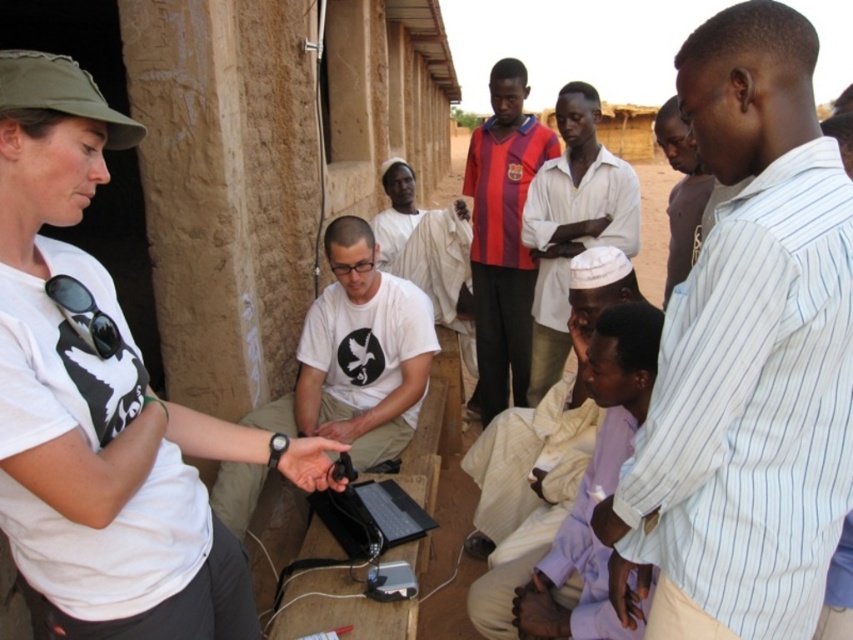
Is striped fabric shirt at center in front of matte white shirt at upper right?

No, it is not.

In the scene shown: Who is more forward, (x=503, y=168) or (x=672, y=193)?

Point (x=672, y=193) is more forward.

Identify the location of striped fabric shirt at center. Image resolution: width=853 pixels, height=640 pixels. (502, 236).

Is point (4, 227) positioned behind point (657, 128)?

No, (4, 227) is closer to viewer.

Is point (62, 61) less distant than point (685, 264)?

Yes, it is in front of point (685, 264).

What do you see at coordinates (103, 403) in the screenshot? I see `white matte t-shirt at left` at bounding box center [103, 403].

The image size is (853, 640). In order to click on white matte t-shirt at left in this screenshot , I will do `click(103, 403)`.

Is point (476, 314) more distant than point (344, 545)?

Yes, it is behind point (344, 545).

Which is more to the left, striped fabric shirt at center or black plastic laptop at center?

Positioned to the left is black plastic laptop at center.

Identify the location of striped fabric shirt at center. Image resolution: width=853 pixels, height=640 pixels. (502, 236).